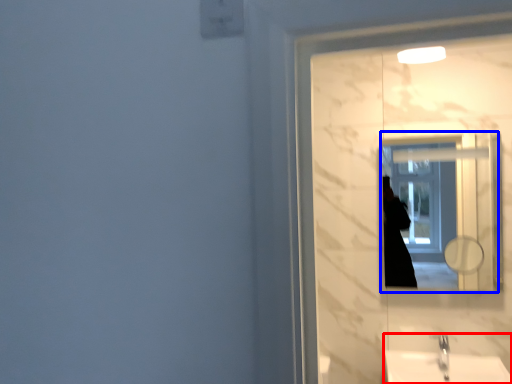
Question: Which object is further to the camera taking this photo, sink (highlighted by a red box) or mirror (highlighted by a blue box)?

Choices:
 (A) sink
 (B) mirror

Answer: (B)